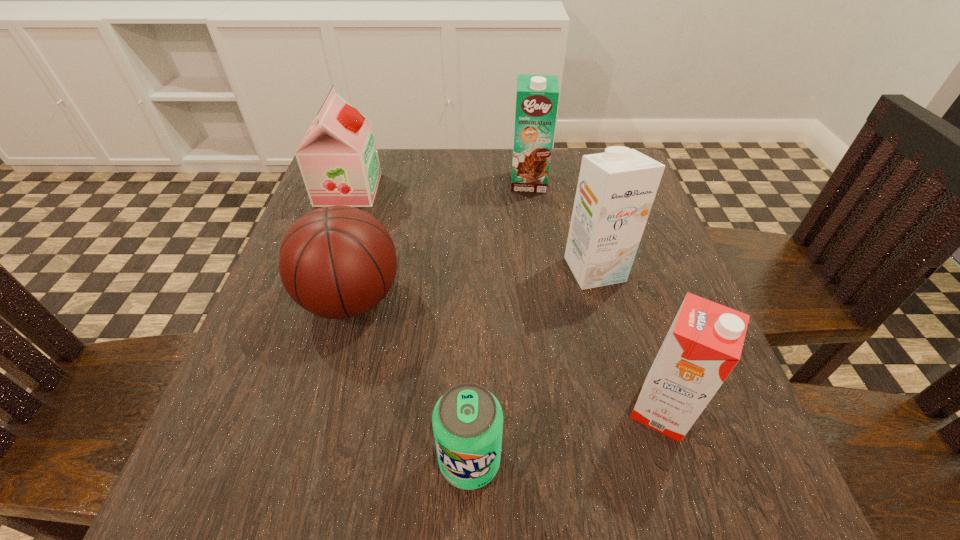
Locate an element on the screen. The width and height of the screenshot is (960, 540). empty space that is in between the basketball and the leftmost carton is located at coordinates (440, 241).

Find the location of a particular element. unoccupied area between the leftmost carton and the shortest carton is located at coordinates (595, 296).

Locate an element on the screen. This screenshot has height=540, width=960. vacant point located between the basketball and the nearest carton is located at coordinates (506, 355).

Image resolution: width=960 pixels, height=540 pixels. I want to click on the fifth closest object to the second shortest object, so click(x=704, y=343).

Where is `object that is the third closest one to the second farthest carton`? The height and width of the screenshot is (540, 960). object that is the third closest one to the second farthest carton is located at coordinates (467, 420).

Locate which carton is the closest to the soya milk. Please provide its 2D coordinates. Your answer should be formatted as a tuple, i.e. [(x, y)], where the tuple contains the x and y coordinates of a point satisfying the conditions above.

[(537, 96)]

At what (x,y) coordinates should I click in order to perform the action: click on the closest carton relative to the second farthest carton. Please return your answer as a coordinate pair (x, y). Looking at the image, I should click on (704, 343).

I want to click on blank area in the image that satisfies the following two spatial constraints: 1. with the cap open on the soya milk; 2. on the right side of the nearest carton, so click(x=270, y=410).

This screenshot has width=960, height=540. Find the location of `free spot that satisfies the following two spatial constraints: 1. with the cap open on the second farthest carton; 2. on the left side of the soya milk`. free spot that satisfies the following two spatial constraints: 1. with the cap open on the second farthest carton; 2. on the left side of the soya milk is located at coordinates (320, 269).

Find the location of a particular element. This screenshot has height=540, width=960. free space that satisfies the following two spatial constraints: 1. with the cap open on the soya milk; 2. on the back side of the second farthest carton is located at coordinates (320, 269).